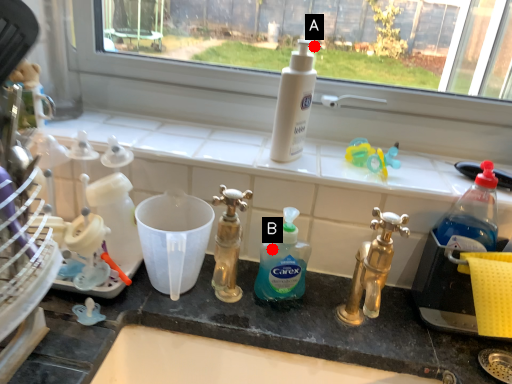
Question: Two points are circled on the image, labeled by A and B beside each circle. Which point is farther from the camera taking this photo?

Choices:
 (A) A is further
 (B) B is further

Answer: (A)